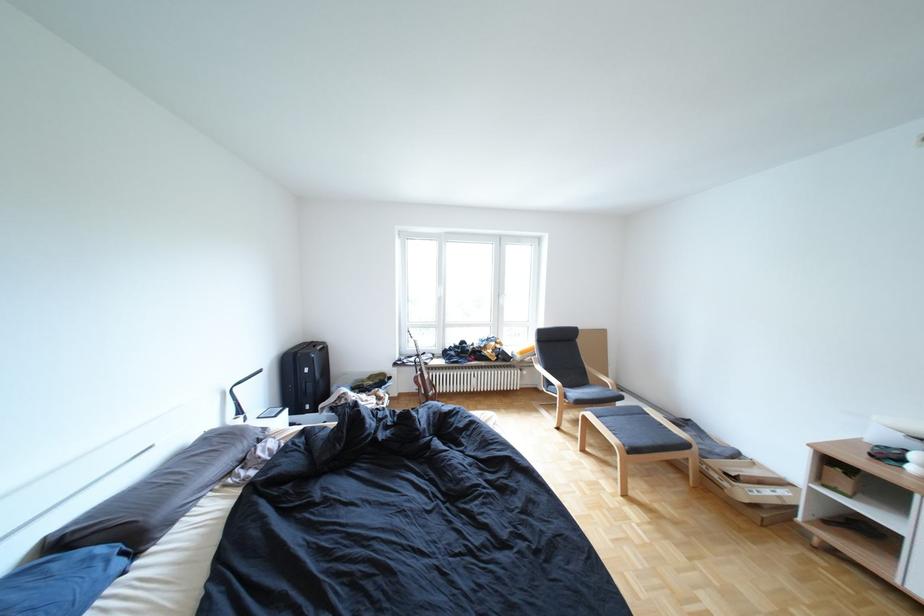
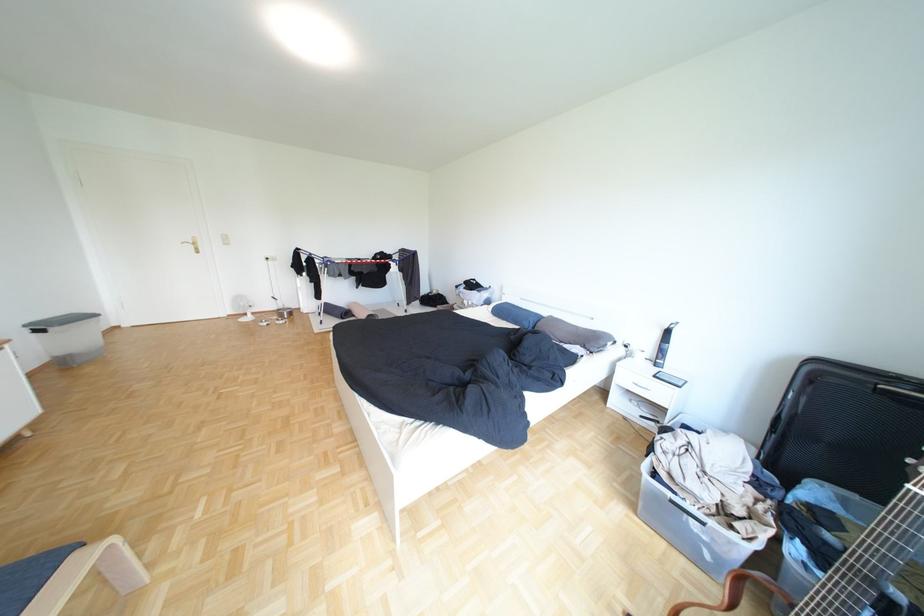
The point at (274, 440) is marked in the first image. Where is the corresponding point in the second image?

(600, 347)